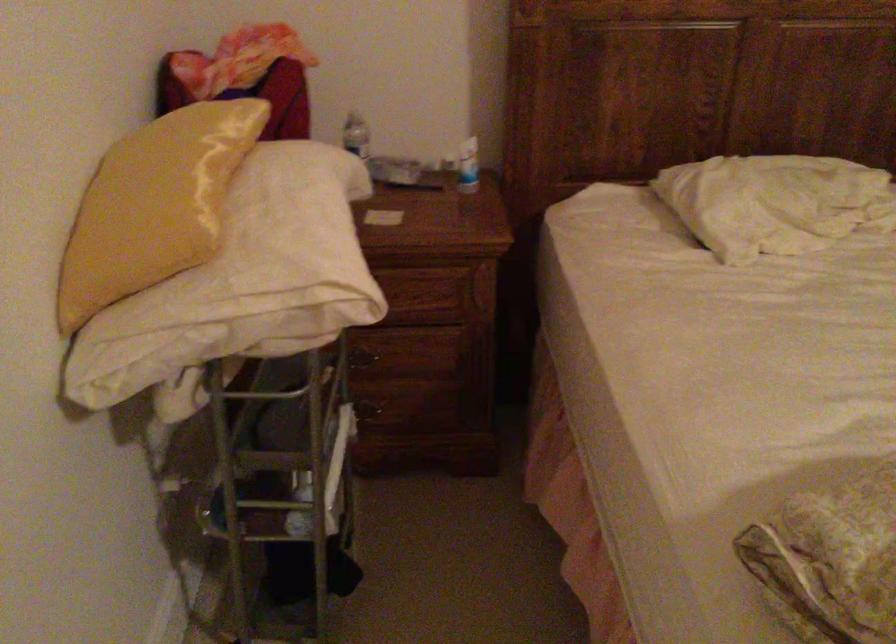
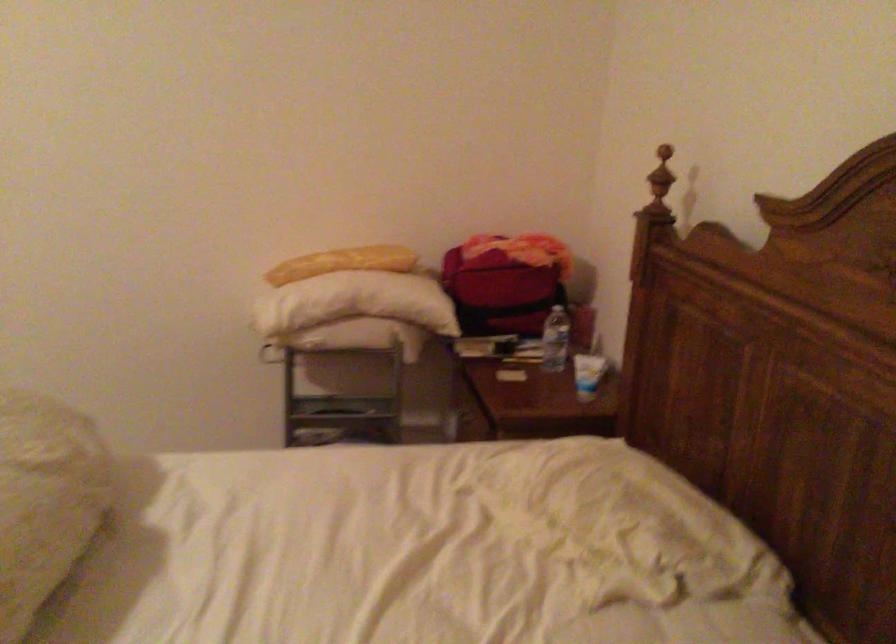
The point at (383, 153) is marked in the first image. Where is the corresponding point in the second image?

(556, 339)